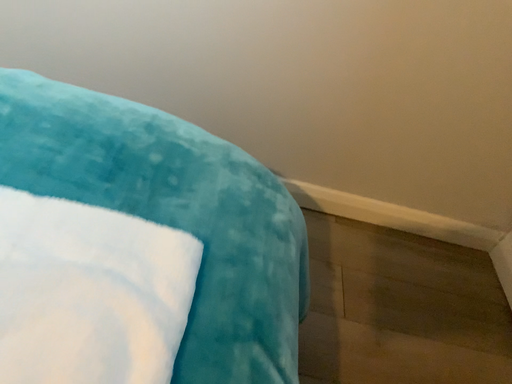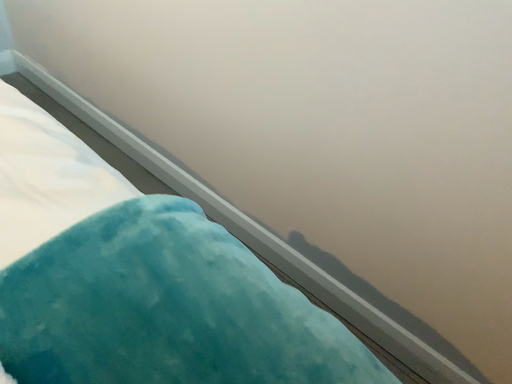
Question: Which way did the camera rotate in the video?

Choices:
 (A) rotated upward
 (B) rotated downward

Answer: (A)